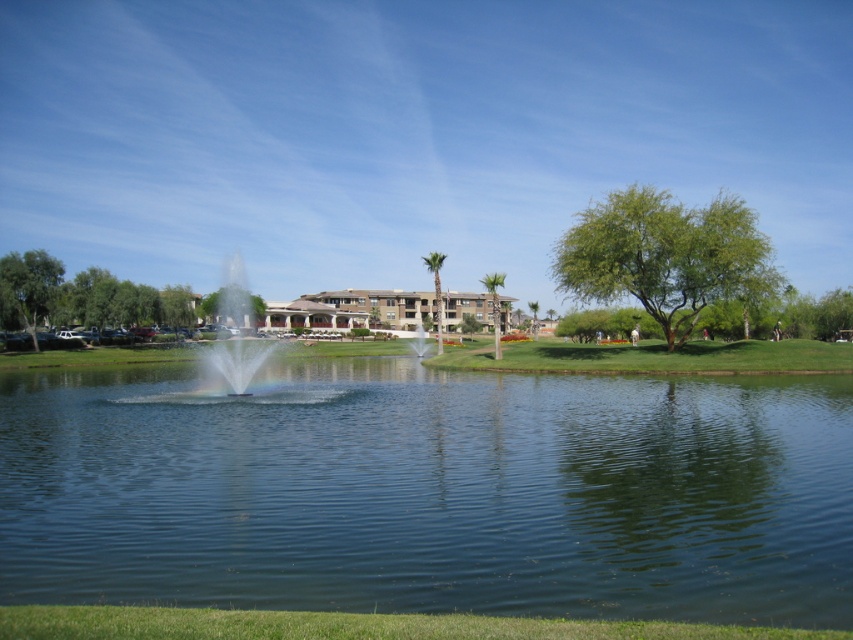
From the picture: Does clear blue water at center appear on the right side of green grass at lower center?

Correct, you'll find clear blue water at center to the right of green grass at lower center.

What do you see at coordinates (430, 492) in the screenshot? I see `clear blue water at center` at bounding box center [430, 492].

Which is in front, point (431, 602) or point (482, 621)?

Point (482, 621) is in front.

What are the coordinates of `clear blue water at center` in the screenshot? It's located at (430, 492).

Is clear water fountain at center further to camera compared to clear glass fountain at center?

No, clear water fountain at center is closer to the viewer.

Consider the image. Does clear water fountain at center have a lesser width compared to clear glass fountain at center?

In fact, clear water fountain at center might be wider than clear glass fountain at center.

You are a GUI agent. You are given a task and a screenshot of the screen. Output one action in this format:
    pyautogui.click(x=<x>, y=<y>)
    Task: Click on the clear water fountain at center
    The image size is (853, 640).
    Given the screenshot: What is the action you would take?
    pyautogui.click(x=228, y=348)

What are the coordinates of `clear water fountain at center` in the screenshot? It's located at (228, 348).

Can you confirm if green grass at lower center is positioned to the left of clear water fountain at center?

Incorrect, green grass at lower center is not on the left side of clear water fountain at center.

Can you confirm if green grass at lower center is positioned above clear water fountain at center?

Actually, green grass at lower center is below clear water fountain at center.

Who is more forward, (492, 620) or (131, 400)?

Positioned in front is point (492, 620).

At what (x,y) coordinates should I click in order to perform the action: click on green grass at lower center. Please return your answer as a coordinate pair (x, y). The width and height of the screenshot is (853, 640). Looking at the image, I should click on (349, 625).